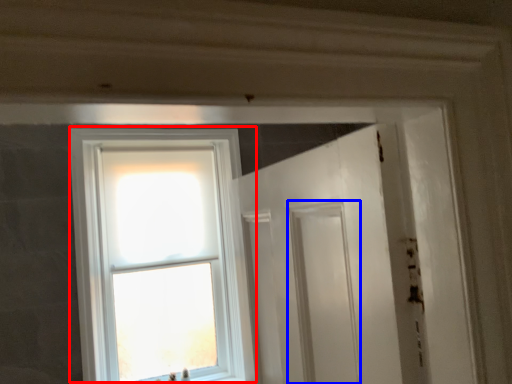
Question: Among these objects, which one is nearest to the camera, window (highlighted by a red box) or screen door (highlighted by a blue box)?

Choices:
 (A) window
 (B) screen door

Answer: (A)